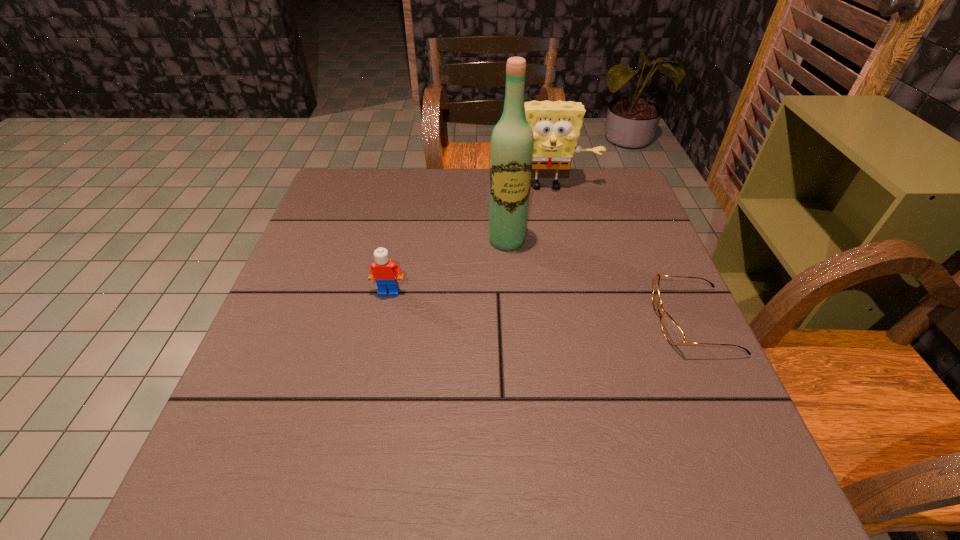
Identify the location of Lego. Image resolution: width=960 pixels, height=540 pixels. tap(384, 271).

This screenshot has height=540, width=960. Find the location of `the second shortest object`. the second shortest object is located at coordinates [x=384, y=271].

Where is `the rightmost object`? the rightmost object is located at coordinates (674, 334).

This screenshot has height=540, width=960. Identify the location of spectacles. click(x=674, y=334).

The height and width of the screenshot is (540, 960). I want to click on the third shortest object, so click(556, 126).

This screenshot has width=960, height=540. What are the coordinates of `the farthest object` in the screenshot? It's located at (556, 126).

Where is `the third nearest object`? the third nearest object is located at coordinates (512, 141).

Identify the location of wine bottle. (512, 141).

Identify the location of vacant position located on the face of the third tallest object. The width and height of the screenshot is (960, 540). (374, 360).

Where is `vacant space situated 0.270m on the front-facing side of the shortest object`? vacant space situated 0.270m on the front-facing side of the shortest object is located at coordinates (529, 321).